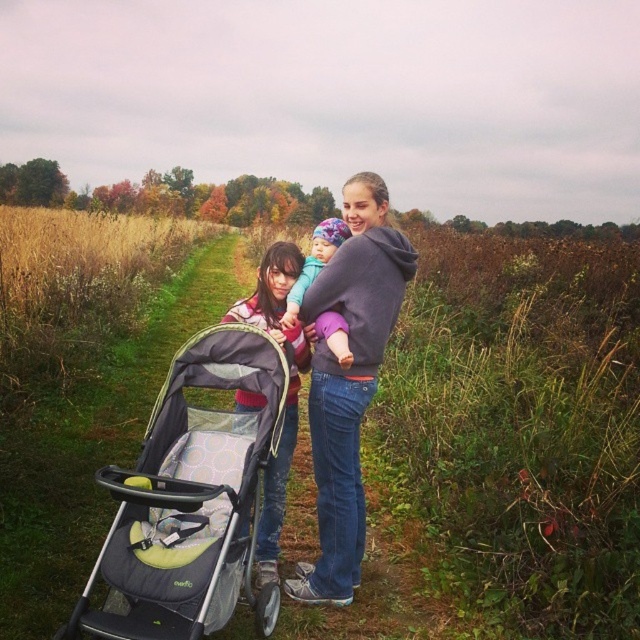
You are a parent carrying a toddler and need to place your gray hoodie at center and purple fleece jacket at center into a backpack. The backpack has a maximum width of 24 inches. Can both items fit side by side in the backpack?

The distance between the gray hoodie at center and purple fleece jacket at center is 25.16 inches, which exceeds the backpack width of 24 inches. Therefore, they cannot fit side by side.

You are a parent trying to push the black fabric stroller at center while wearing the purple fleece jacket at center. Considering their sizes, will the stroller be harder to maneuver through the narrow grassy path?

The black fabric stroller at center has a larger size compared to purple fleece jacket at center, so it may be harder to maneuver through the narrow grassy path due to its larger size.